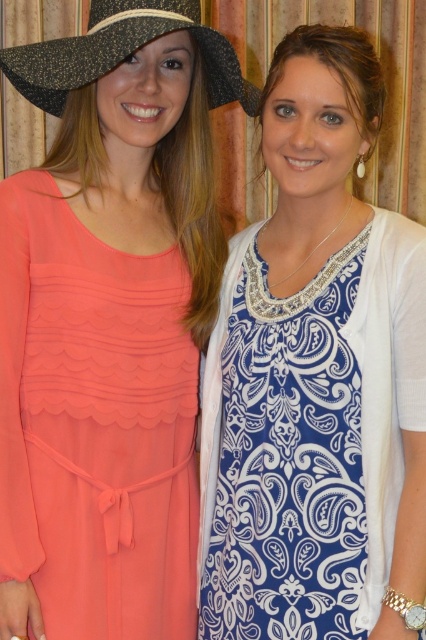
What do you see at coordinates (94, 424) in the screenshot? This screenshot has height=640, width=426. I see `coral chiffon dress at left` at bounding box center [94, 424].

Does point (31, 252) come closer to viewer compared to point (112, 42)?

No, it is not.

Which is in front, point (28, 333) or point (207, 51)?

Positioned in front is point (28, 333).

The height and width of the screenshot is (640, 426). I want to click on coral chiffon dress at left, so (94, 424).

Can you confirm if blue printed dress at center is shorter than coral chiffon dress at left?

Incorrect, blue printed dress at center's height does not fall short of coral chiffon dress at left's.

Can you confirm if blue printed dress at center is positioned below coral chiffon dress at left?

Incorrect, blue printed dress at center is not positioned below coral chiffon dress at left.

What do you see at coordinates (316, 378) in the screenshot? The height and width of the screenshot is (640, 426). I see `blue printed dress at center` at bounding box center [316, 378].

At what (x,y) coordinates should I click in order to perform the action: click on blue printed dress at center. Please return your answer as a coordinate pair (x, y). This screenshot has width=426, height=640. Looking at the image, I should click on click(316, 378).

Between blue printed dress at center and speckled fabric cowboy hat at upper left, which one has less height?

speckled fabric cowboy hat at upper left

Who is more forward, (x=379, y=323) or (x=126, y=44)?

Point (x=126, y=44) is in front.

This screenshot has height=640, width=426. Identify the location of blue printed dress at center. (316, 378).